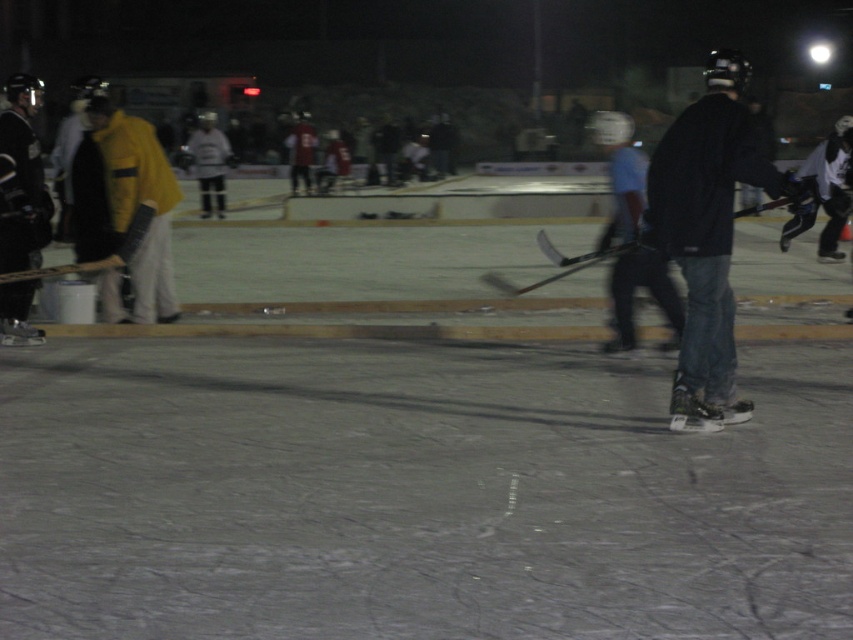
You are a hockey player standing at the edge of the rink. You see the black matte hockey stick at center and the matte black hockey stick at left. Which one is closer to you?

The matte black hockey stick at left is closer to you since it is only 3.80 meters away from the black matte hockey stick at center, but without knowing your exact position, it is hard to determine the exact distance from you.

You are a hockey player standing at the edge of the rink and see the black matte hockey stick at center and the matte black hockey stick at left. Which one is closer to your right side?

The black matte hockey stick at center is to the right of matte black hockey stick at left, so the black matte hockey stick at center is closer to your right side.

You are a hockey player standing on the white ice at center. You want to retrieve your black matte hockey stick at center. Can you reach it without moving your feet?

The black matte hockey stick at center is behind the white ice at center, so you cannot reach it without moving your feet because it is located behind you.